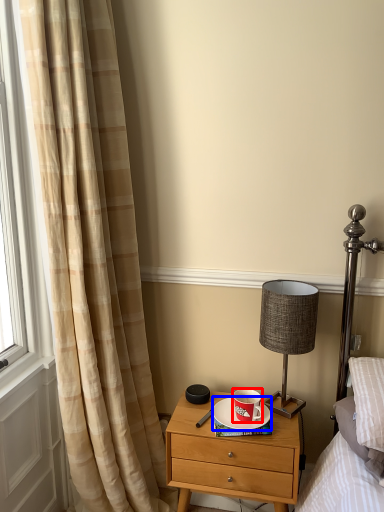
Question: Which point is further to the camera, coffee cup (highlighted by a red box) or saucer (highlighted by a blue box)?

Choices:
 (A) coffee cup
 (B) saucer

Answer: (B)